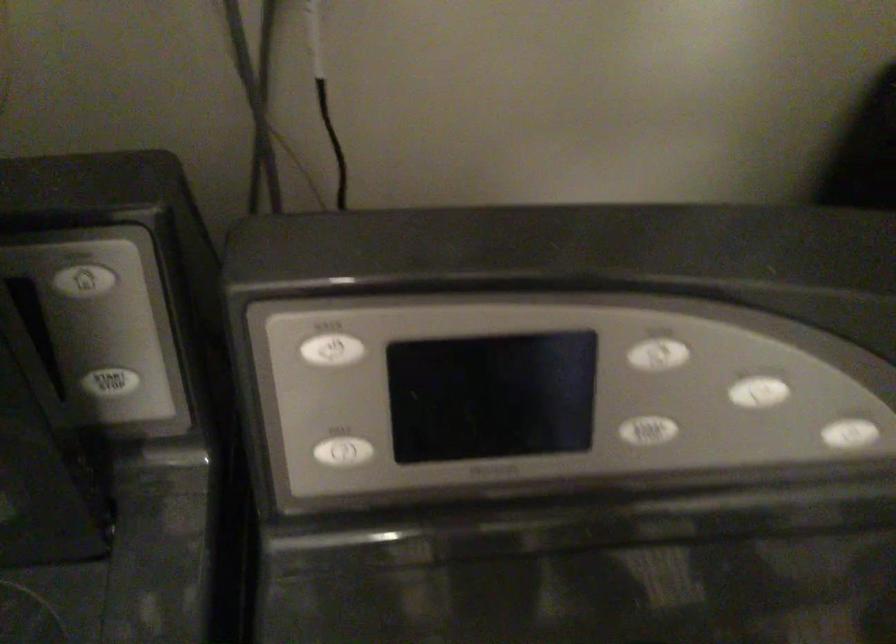
Where is `start stop button`? The image size is (896, 644). start stop button is located at coordinates (658, 348).